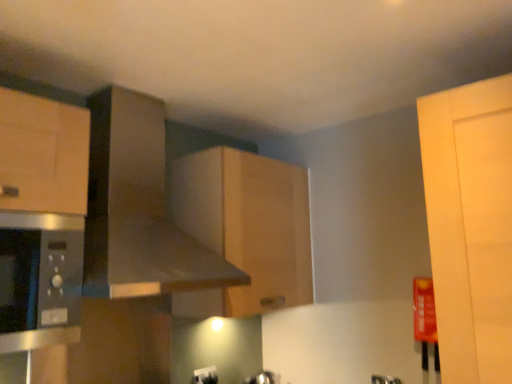
Image resolution: width=512 pixels, height=384 pixels. Identify the location of wooden cabinet at center. (245, 229).

Choose the correct answer: Is white plastic electric outlet at lower center inside metallic gray exhaust hood at upper center or outside it?

white plastic electric outlet at lower center is located beyond the bounds of metallic gray exhaust hood at upper center.

Does white plastic electric outlet at lower center turn towards metallic gray exhaust hood at upper center?

No, white plastic electric outlet at lower center is not aimed at metallic gray exhaust hood at upper center.

Would you consider white plastic electric outlet at lower center to be distant from metallic gray exhaust hood at upper center?

That's not correct — white plastic electric outlet at lower center is a little close to metallic gray exhaust hood at upper center.

Is point (207, 376) behind point (237, 209)?

Yes, it is behind point (237, 209).

Is the depth of white plastic electric outlet at lower center greater than that of wooden cabinet at center?

Yes, white plastic electric outlet at lower center is further from the camera.

Based on the photo, from a real-world perspective, which object rests below the other?

From a 3D spatial view, white plastic electric outlet at lower center is below.

Who is shorter, white plastic electric outlet at lower center or wooden cabinet at center?

white plastic electric outlet at lower center is shorter.

Is matte silver faucet at lower center inside the boundaries of metallic gray exhaust hood at upper center, or outside?

matte silver faucet at lower center lies outside metallic gray exhaust hood at upper center.

Where is `exhaust hood in front of the matte silver faucet at lower center`? The width and height of the screenshot is (512, 384). exhaust hood in front of the matte silver faucet at lower center is located at coordinates (138, 208).

Which is behind, matte silver faucet at lower center or metallic gray exhaust hood at upper center?

matte silver faucet at lower center is more distant.

In the scene shown: From the image's perspective, is matte silver faucet at lower center below metallic gray exhaust hood at upper center?

Indeed, from the image's perspective, matte silver faucet at lower center is shown beneath metallic gray exhaust hood at upper center.

How many degrees apart are the facing directions of satin silver microwave at left and matte silver faucet at lower center?

satin silver microwave at left and matte silver faucet at lower center are facing 89 degrees away from each other.

Is satin silver microwave at left to the left or to the right of matte silver faucet at lower center in the image?

In the image, satin silver microwave at left appears on the left side of matte silver faucet at lower center.

How distant is satin silver microwave at left from matte silver faucet at lower center?

satin silver microwave at left is 1.46 meters away from matte silver faucet at lower center.

Is point (52, 232) in front of point (386, 381)?

That is True.

Is wooden cabinet at center directly adjacent to metallic gray exhaust hood at upper center?

No, wooden cabinet at center is not beside metallic gray exhaust hood at upper center.

Based on the photo, looking at the image, does wooden cabinet at center seem bigger or smaller compared to metallic gray exhaust hood at upper center?

In the image, wooden cabinet at center appears to be smaller than metallic gray exhaust hood at upper center.

Considering the relative positions of wooden cabinet at center and metallic gray exhaust hood at upper center in the image provided, is wooden cabinet at center in front of metallic gray exhaust hood at upper center?

No.

Choose the correct answer: Is wooden cabinet at center inside white plastic electric outlet at lower center or outside it?

The correct answer is: outside.

Considering the relative sizes of wooden cabinet at center and white plastic electric outlet at lower center in the image provided, is wooden cabinet at center wider than white plastic electric outlet at lower center?

Yes.

From a real-world perspective, is wooden cabinet at center positioned over white plastic electric outlet at lower center based on gravity?

Correct, in the physical world, wooden cabinet at center is higher than white plastic electric outlet at lower center.

In the scene shown: From the image's perspective, relative to white plastic electric outlet at lower center, is wooden cabinet at center above or below?

From the image's perspective, wooden cabinet at center appears above white plastic electric outlet at lower center.

Could you tell me if metallic gray exhaust hood at upper center is facing wooden cabinet at center?

No.

Which object is thinner, metallic gray exhaust hood at upper center or wooden cabinet at center?

wooden cabinet at center.

From the image's perspective, would you say metallic gray exhaust hood at upper center is shown under wooden cabinet at center?

No, from the image's perspective, metallic gray exhaust hood at upper center is not below wooden cabinet at center.

Looking at this image, which is in front, metallic gray exhaust hood at upper center or wooden cabinet at center?

metallic gray exhaust hood at upper center.

Image resolution: width=512 pixels, height=384 pixels. Identify the location of exhaust hood that is in front of the white plastic electric outlet at lower center. (138, 208).

Where is `electric outlet lying behind the wooden cabinet at center`? The image size is (512, 384). electric outlet lying behind the wooden cabinet at center is located at coordinates (205, 375).

Looking at the image, which one is located closer to wooden cabinet at center, metallic gray exhaust hood at upper center or satin silver microwave at left?

metallic gray exhaust hood at upper center is positioned closer to the anchor wooden cabinet at center.

When comparing their distances from satin silver microwave at left, does white plastic electric outlet at lower center or wooden cabinet at center seem closer?

wooden cabinet at center.

When comparing their distances from matte silver faucet at lower center, does white plastic electric outlet at lower center or satin silver microwave at left seem closer?

white plastic electric outlet at lower center.

Which object lies nearer to the anchor point wooden cabinet at center, white plastic electric outlet at lower center or matte silver faucet at lower center?

white plastic electric outlet at lower center.

Consider the image. From the image, which object appears to be farther from metallic gray exhaust hood at upper center, white plastic electric outlet at lower center or matte silver faucet at lower center?

matte silver faucet at lower center is positioned further to the anchor metallic gray exhaust hood at upper center.

Looking at the image, which one is located closer to metallic gray exhaust hood at upper center, matte silver faucet at lower center or satin silver microwave at left?

satin silver microwave at left lies closer to metallic gray exhaust hood at upper center than the other object.

Looking at the image, which one is located further to white plastic electric outlet at lower center, wooden cabinet at center or matte silver faucet at lower center?

The object further to white plastic electric outlet at lower center is matte silver faucet at lower center.

Estimate the real-world distances between objects in this image. Which object is further from satin silver microwave at left, white plastic electric outlet at lower center or metallic gray exhaust hood at upper center?

white plastic electric outlet at lower center.

In order to click on cabinetry that lies between metallic gray exhaust hood at upper center and white plastic electric outlet at lower center from top to bottom in this screenshot , I will do coord(245,229).

Locate an element on the screen. cabinetry situated between satin silver microwave at left and matte silver faucet at lower center from left to right is located at coordinates (245, 229).

This screenshot has width=512, height=384. I want to click on exhaust hood between satin silver microwave at left and white plastic electric outlet at lower center in the front-back direction, so click(x=138, y=208).

Find the location of a particular element. cabinetry positioned between satin silver microwave at left and white plastic electric outlet at lower center from near to far is located at coordinates (245, 229).